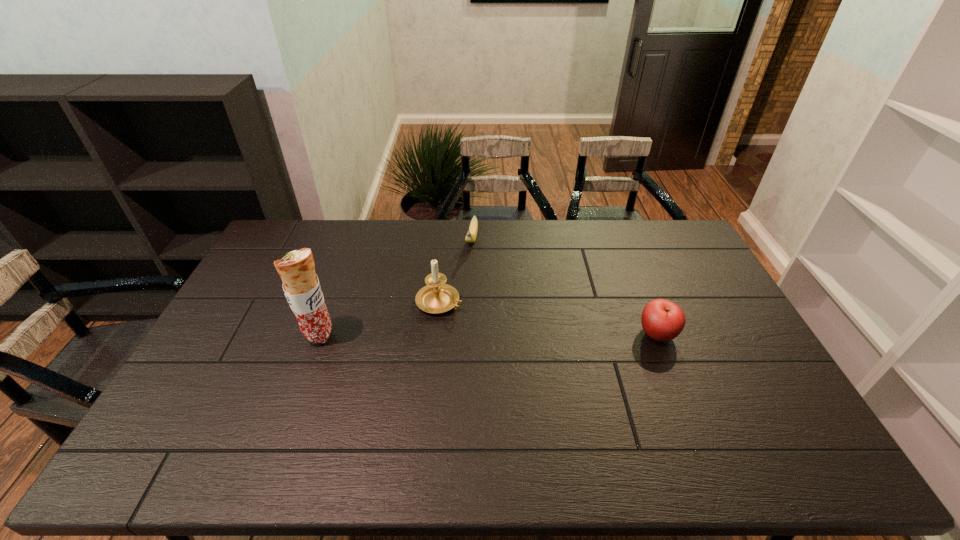
Where is `vacant area that lies between the candle holder and the second shortest object`? This screenshot has height=540, width=960. vacant area that lies between the candle holder and the second shortest object is located at coordinates (548, 318).

Find the location of a particular element. The width and height of the screenshot is (960, 540). vacant area that lies between the shortest object and the third object from right to left is located at coordinates (456, 271).

Select which object appears as the closest to the burrito. Please provide its 2D coordinates. Your answer should be formatted as a tuple, i.e. [(x, y)], where the tuple contains the x and y coordinates of a point satisfying the conditions above.

[(437, 297)]

Where is `object that stands as the closest to the farthest object`? object that stands as the closest to the farthest object is located at coordinates (437, 297).